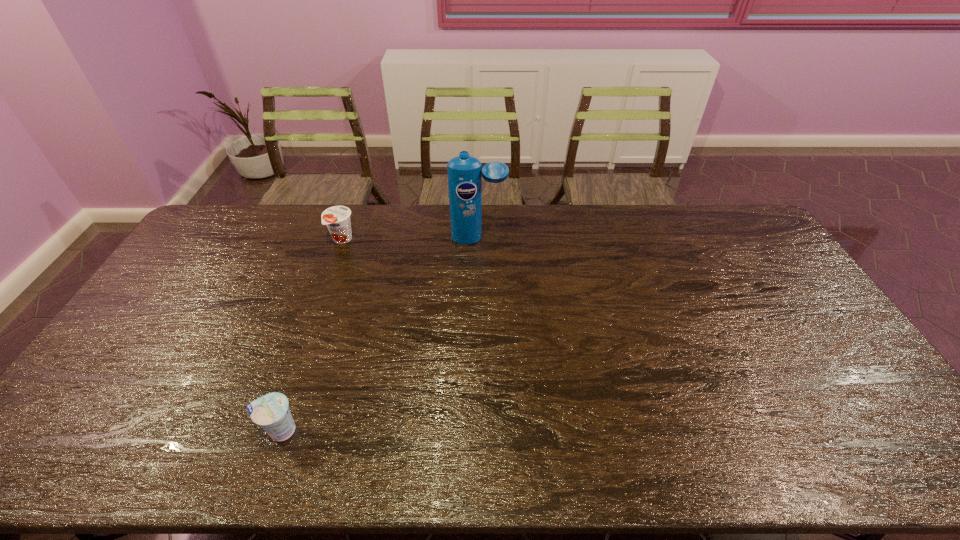
At what (x,y) coordinates should I click in order to perform the action: click on vacant point that satisfies the following two spatial constraints: 1. on the back side of the tallest object; 2. on the left side of the nearer yogurt. Please return your answer as a coordinate pair (x, y). This screenshot has height=540, width=960. Looking at the image, I should click on (347, 239).

This screenshot has width=960, height=540. I want to click on vacant space that satisfies the following two spatial constraints: 1. on the back side of the rightmost object; 2. on the right side of the nearer yogurt, so click(347, 239).

The width and height of the screenshot is (960, 540). I want to click on vacant space that satisfies the following two spatial constraints: 1. on the back side of the rightmost object; 2. on the right side of the farther yogurt, so click(x=343, y=239).